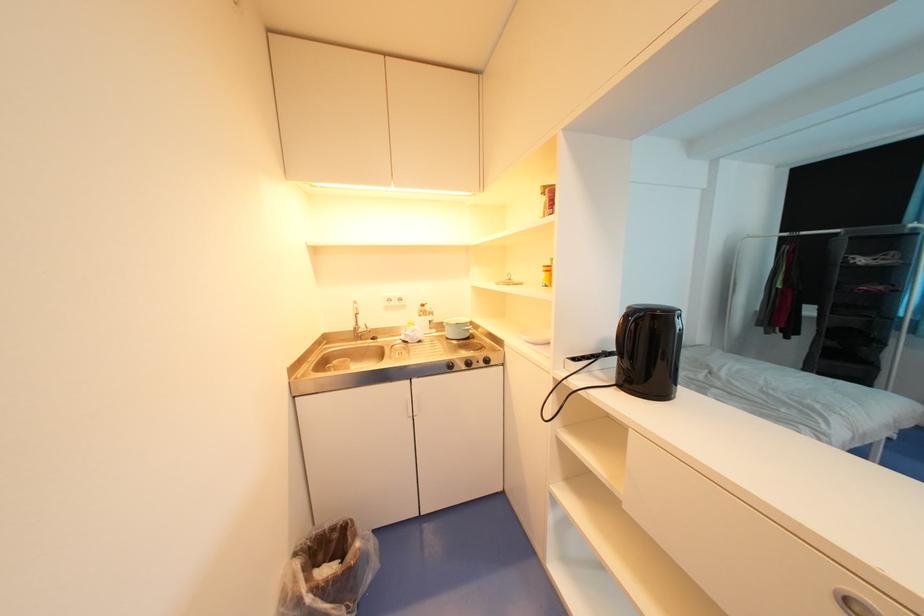
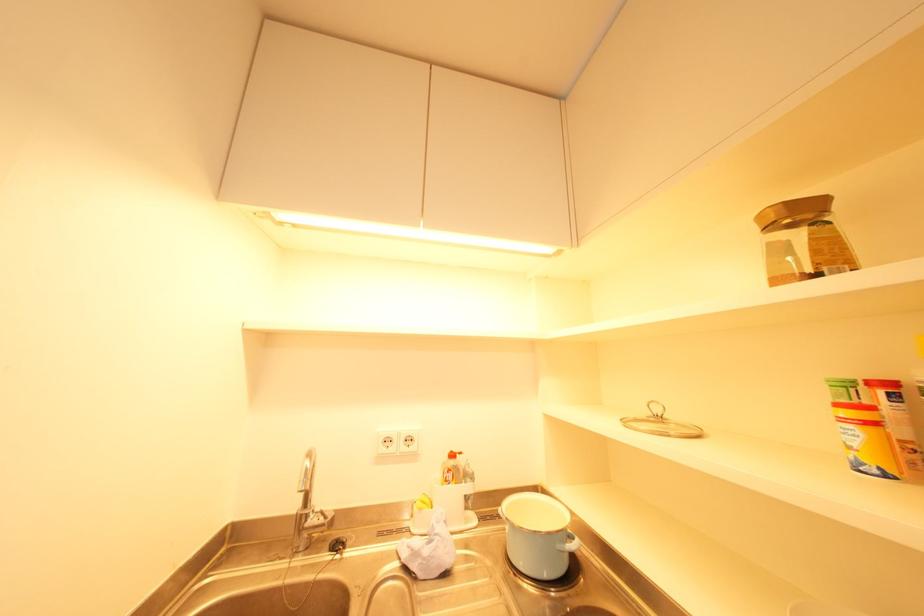
Question: In a continuous first-person perspective shot, in which direction is the camera moving?

Choices:
 (A) Left
 (B) Right
 (C) Forward
 (D) Backward

Answer: (C)